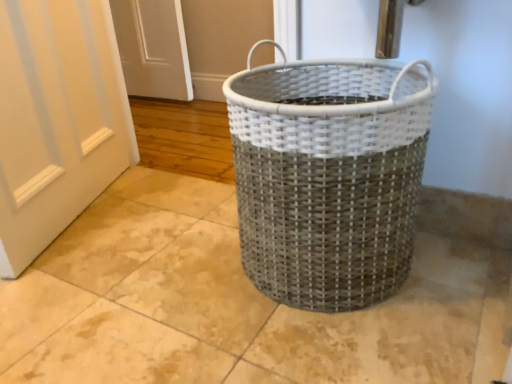
Question: From the image's perspective, would you say white woven basket at center is shown under white painted wood door at left?

Choices:
 (A) yes
 (B) no

Answer: (A)

Question: Does white woven basket at center lie in front of white painted wood door at left?

Choices:
 (A) no
 (B) yes

Answer: (B)

Question: Considering the relative sizes of white woven basket at center and white painted wood door at left in the image provided, is white woven basket at center smaller than white painted wood door at left?

Choices:
 (A) no
 (B) yes

Answer: (A)

Question: Are white woven basket at center and white painted wood door at left far apart?

Choices:
 (A) yes
 (B) no

Answer: (B)

Question: Could you tell me if white woven basket at center is turned towards white painted wood door at left?

Choices:
 (A) no
 (B) yes

Answer: (A)

Question: Does white woven basket at center lie behind white painted wood door at left?

Choices:
 (A) no
 (B) yes

Answer: (A)

Question: Is white painted wood door at left located outside white woven basket at center?

Choices:
 (A) yes
 (B) no

Answer: (A)

Question: Is white painted wood door at left positioned behind white woven basket at center?

Choices:
 (A) no
 (B) yes

Answer: (B)

Question: Is white painted wood door at left next to white woven basket at center and touching it?

Choices:
 (A) yes
 (B) no

Answer: (B)

Question: Is white painted wood door at left looking in the opposite direction of white woven basket at center?

Choices:
 (A) no
 (B) yes

Answer: (A)

Question: From the image's perspective, would you say white painted wood door at left is shown under white woven basket at center?

Choices:
 (A) yes
 (B) no

Answer: (B)

Question: From the image's perspective, is white painted wood door at left located above white woven basket at center?

Choices:
 (A) yes
 (B) no

Answer: (A)

Question: Relative to white painted wood door at left, is white woven basket at center in front or behind?

Choices:
 (A) front
 (B) behind

Answer: (A)